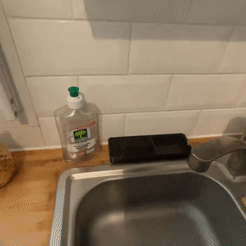
At what (x,y) coordinates should I click in order to perform the action: click on faucet. Please return your answer as a coordinate pair (x, y). Looking at the image, I should click on (235, 185).